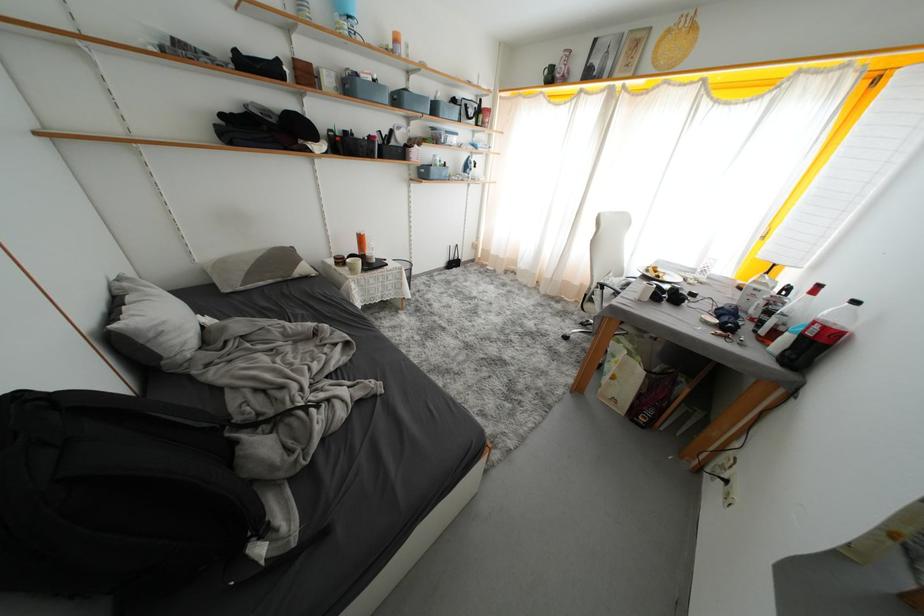
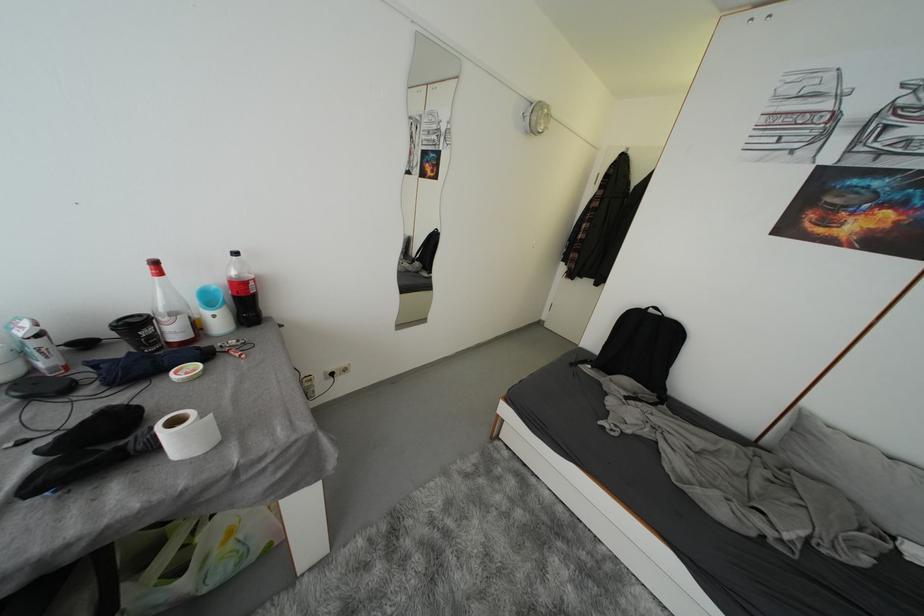
The point at [767,328] is marked in the first image. Where is the corresponding point in the second image?

(162, 342)